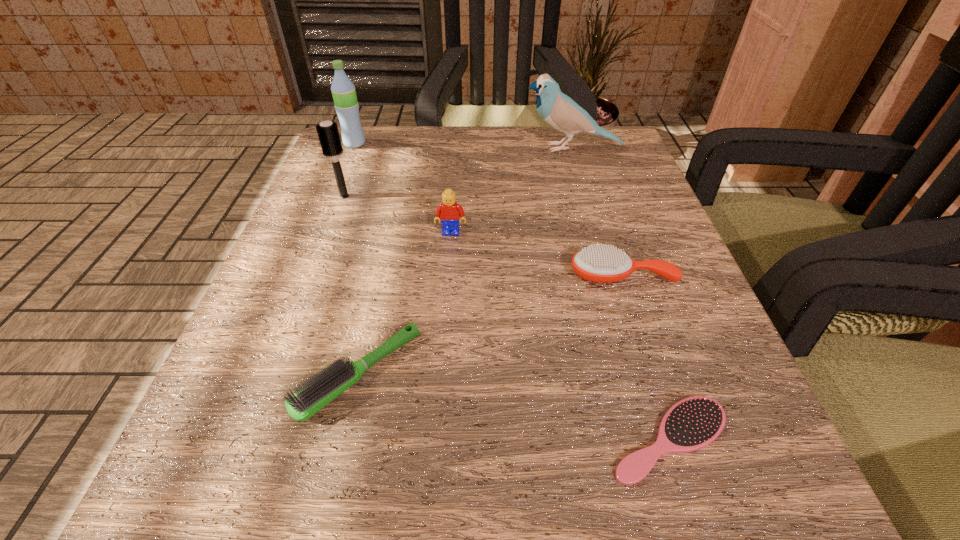
At what (x,y) coordinates should I click in order to perform the action: click on water bottle. Please return your answer as a coordinate pair (x, y). Looking at the image, I should click on (346, 105).

The image size is (960, 540). What are the coordinates of `bird` in the screenshot? It's located at (562, 113).

Find the location of a particular element. the leftmost hairbrush is located at coordinates (328, 133).

Locate an element on the screen. The height and width of the screenshot is (540, 960). the fifth nearest object is located at coordinates (328, 133).

This screenshot has width=960, height=540. I want to click on the fourth nearest object, so click(448, 212).

Locate an element on the screen. the fourth shortest object is located at coordinates point(448,212).

Identify the location of the second tallest hairbrush. (599, 263).

The height and width of the screenshot is (540, 960). What are the coordinates of `the fifth tallest object` in the screenshot? It's located at (599, 263).

The height and width of the screenshot is (540, 960). What are the coordinates of `the sixth tallest object` in the screenshot? It's located at (331, 382).

At what (x,y) coordinates should I click in order to perform the action: click on the second hairbrush from left to right. Please return your answer as a coordinate pair (x, y). Image resolution: width=960 pixels, height=540 pixels. Looking at the image, I should click on (331, 382).